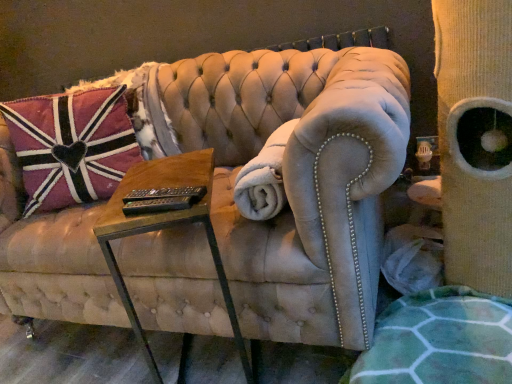
Where is `white plush blanket at center`? The image size is (512, 384). white plush blanket at center is located at coordinates (264, 178).

In order to face woodenmaterial/texturetable at center, should I rotate leftwards or rightwards?

Rotate your view left by about 8.587°.

What are the coordinates of `woodenmaterial/texturetable at center` in the screenshot? It's located at (165, 228).

The width and height of the screenshot is (512, 384). Describe the element at coordinates (457, 146) in the screenshot. I see `beige corduroy cat tree at right` at that location.

What do you see at coordinates (71, 146) in the screenshot? The image size is (512, 384). I see `pink velvet pillow at left` at bounding box center [71, 146].

This screenshot has width=512, height=384. Identify the location of white plush blanket at center. (264, 178).

Which is in front, suede couch at center or woodenmaterial/texturetable at center?

suede couch at center is in front.

From a real-world perspective, is suede couch at center physically located above or below woodenmaterial/texturetable at center?

Clearly, from a real-world perspective, suede couch at center is above woodenmaterial/texturetable at center.

Measure the distance from suede couch at center to woodenmaterial/texturetable at center.

A distance of 26.88 centimeters exists between suede couch at center and woodenmaterial/texturetable at center.

From a real-world perspective, is suede couch at center located beneath beige corduroy cat tree at right?

Yes.

This screenshot has height=384, width=512. I want to click on furniture below the beige corduroy cat tree at right (from a real-world perspective), so click(x=296, y=177).

Is suede couch at center spatially inside beige corduroy cat tree at right, or outside of it?

suede couch at center is not enclosed by beige corduroy cat tree at right.

From the picture: Is beige corduroy cat tree at right located outside pink velvet pillow at left?

Yes, beige corduroy cat tree at right is not within pink velvet pillow at left.

How many degrees apart are the facing directions of beige corduroy cat tree at right and pink velvet pillow at left?

The facing directions of beige corduroy cat tree at right and pink velvet pillow at left are 38.8 degrees apart.

From a real-world perspective, is beige corduroy cat tree at right positioned under pink velvet pillow at left based on gravity?

Indeed, from a real-world perspective, beige corduroy cat tree at right is positioned beneath pink velvet pillow at left.

Considering the relative sizes of beige corduroy cat tree at right and pink velvet pillow at left in the image provided, is beige corduroy cat tree at right bigger than pink velvet pillow at left?

Actually, beige corduroy cat tree at right might be smaller than pink velvet pillow at left.

From the image's perspective, who appears lower, suede couch at center or white plush blanket at center?

From the image's view, suede couch at center is below.

Is suede couch at center facing away from white plush blanket at center?

Yes, suede couch at center is facing away from white plush blanket at center.

Can you confirm if suede couch at center is wider than white plush blanket at center?

Yes.

At what (x,y) coordinates should I click in order to perform the action: click on blanket behind the suede couch at center. Please return your answer as a coordinate pair (x, y). Image resolution: width=512 pixels, height=384 pixels. Looking at the image, I should click on [x=264, y=178].

From the image's perspective, is suede couch at center positioned above or below pink velvet pillow at left?

From the image's perspective, suede couch at center appears below pink velvet pillow at left.

Is suede couch at center oriented away from pink velvet pillow at left?

Correct, suede couch at center is looking away from pink velvet pillow at left.

Between suede couch at center and pink velvet pillow at left, which one has larger size?

With larger size is suede couch at center.

Considering the points (340, 122) and (96, 175), which point is behind, point (340, 122) or point (96, 175)?

The point (96, 175) is farther.

Is beige corduroy cat tree at right beside suede couch at center?

No, beige corduroy cat tree at right is not with suede couch at center.

Consider the image. Which of these two, beige corduroy cat tree at right or suede couch at center, is bigger?

suede couch at center.

From the image's perspective, which is above, beige corduroy cat tree at right or suede couch at center?

beige corduroy cat tree at right, from the image's perspective.

Does beige corduroy cat tree at right turn towards woodenmaterial/texturetable at center?

No, beige corduroy cat tree at right is not facing towards woodenmaterial/texturetable at center.

From a real-world perspective, between beige corduroy cat tree at right and woodenmaterial/texturetable at center, who is vertically higher?

beige corduroy cat tree at right is physically above.

Between beige corduroy cat tree at right and woodenmaterial/texturetable at center, which one has smaller size?

With smaller size is woodenmaterial/texturetable at center.

Is point (438, 86) closer to camera compared to point (117, 288)?

Yes, point (438, 86) is closer to viewer.

Where is `furniture above the woodenmaterial/texturetable at center (from a real-world perspective)`? The width and height of the screenshot is (512, 384). furniture above the woodenmaterial/texturetable at center (from a real-world perspective) is located at coordinates (296, 177).

Where is `side that appears on the right of suede couch at center`? This screenshot has width=512, height=384. side that appears on the right of suede couch at center is located at coordinates (457, 146).

Considering their positions, is white plush blanket at center positioned further to suede couch at center than woodenmaterial/texturetable at center?

white plush blanket at center lies further to suede couch at center than the other object.

When comparing their distances from white plush blanket at center, does woodenmaterial/texturetable at center or pink velvet pillow at left seem further?

pink velvet pillow at left.

Estimate the real-world distances between objects in this image. Which object is further from white plush blanket at center, beige corduroy cat tree at right or woodenmaterial/texturetable at center?

The object further to white plush blanket at center is beige corduroy cat tree at right.

Considering their positions, is beige corduroy cat tree at right positioned further to suede couch at center than white plush blanket at center?

The object further to suede couch at center is beige corduroy cat tree at right.

Estimate the real-world distances between objects in this image. Which object is further from white plush blanket at center, woodenmaterial/texturetable at center or suede couch at center?

suede couch at center is positioned further to the anchor white plush blanket at center.

Which object lies nearer to the anchor point woodenmaterial/texturetable at center, white plush blanket at center or suede couch at center?

Based on the image, white plush blanket at center appears to be nearer to woodenmaterial/texturetable at center.

When comparing their distances from woodenmaterial/texturetable at center, does suede couch at center or pink velvet pillow at left seem closer?

Based on the image, suede couch at center appears to be nearer to woodenmaterial/texturetable at center.

Considering their positions, is woodenmaterial/texturetable at center positioned further to beige corduroy cat tree at right than suede couch at center?

The object further to beige corduroy cat tree at right is woodenmaterial/texturetable at center.

The height and width of the screenshot is (384, 512). I want to click on furniture situated between pink velvet pillow at left and white plush blanket at center from left to right, so click(x=296, y=177).

The height and width of the screenshot is (384, 512). Find the location of `furniture between pink velvet pillow at left and beige corduroy cat tree at right`. furniture between pink velvet pillow at left and beige corduroy cat tree at right is located at coordinates (296, 177).

Locate an element on the screen. The width and height of the screenshot is (512, 384). table between suede couch at center and pink velvet pillow at left from front to back is located at coordinates (165, 228).

At what (x,y) coordinates should I click in order to perform the action: click on furniture between white plush blanket at center and woodenmaterial/texturetable at center in the up-down direction. Please return your answer as a coordinate pair (x, y). Looking at the image, I should click on (296, 177).